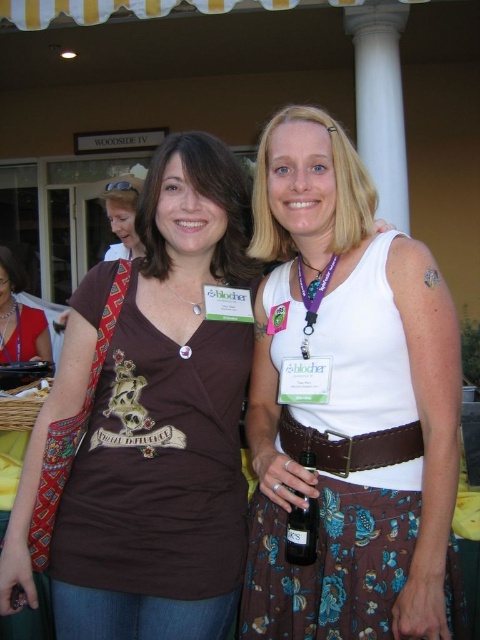
You are a photographer adjusting your camera settings to focus on the brown fabric shirt at center and the purple fabric lanyard at center. Which object should you focus on first if you want to capture both clearly in the same frame?

The brown fabric shirt at center is in front of the purple fabric lanyard at center, so you should focus on the brown fabric shirt at center first to ensure both are in focus.

You are a photographer taking a picture of the two women. You notice the white matte tank top at center and the translucent glass bottle at center. Which object should you focus on first if you want to capture the one that is higher in the frame?

The white matte tank top at center is located above the translucent glass bottle at center, so you should focus on the white matte tank top at center first to capture the higher object in the frame.

You are a photographer trying to capture a closeup shot of the translucent glass bottle at center. However, the purple fabric lanyard at center is blocking your view. Can you estimate whether the bottle can be fully visible without moving the lanyard?

The translucent glass bottle at center occupies less space than the purple fabric lanyard at center, so it might be possible to adjust the angle slightly to ensure the bottle is fully visible without moving the lanyard.